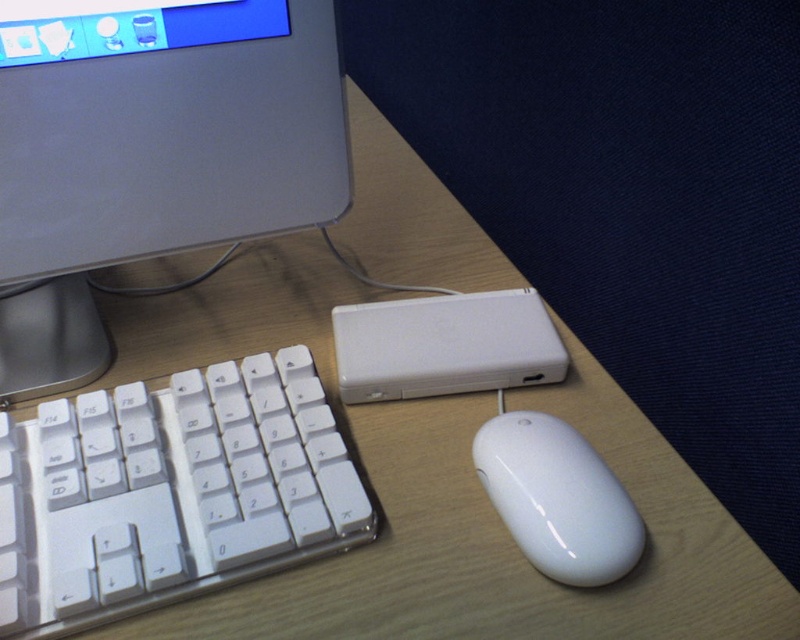
Question: Can you confirm if white plastic keyboard at lower left is smaller than white glossy mouse at lower right?

Choices:
 (A) no
 (B) yes

Answer: (A)

Question: Is satin silver monitor at upper left below white plastic keyboard at lower left?

Choices:
 (A) no
 (B) yes

Answer: (A)

Question: Which object is positioned farthest from the satin silver monitor at upper left?

Choices:
 (A) white glossy mouse at lower right
 (B) matte plastic monitor at upper left

Answer: (A)

Question: Based on their relative distances, which object is farther from the matte plastic monitor at upper left?

Choices:
 (A) satin silver monitor at upper left
 (B) white plastic keyboard at lower left
 (C) white glossy mouse at lower right

Answer: (C)

Question: Which of these objects is positioned closest to the satin silver monitor at upper left?

Choices:
 (A) white glossy mouse at lower right
 (B) matte plastic monitor at upper left
 (C) white plastic keyboard at lower left

Answer: (B)

Question: Can you confirm if white plastic keyboard at lower left is positioned below white glossy mouse at lower right?

Choices:
 (A) no
 (B) yes

Answer: (A)